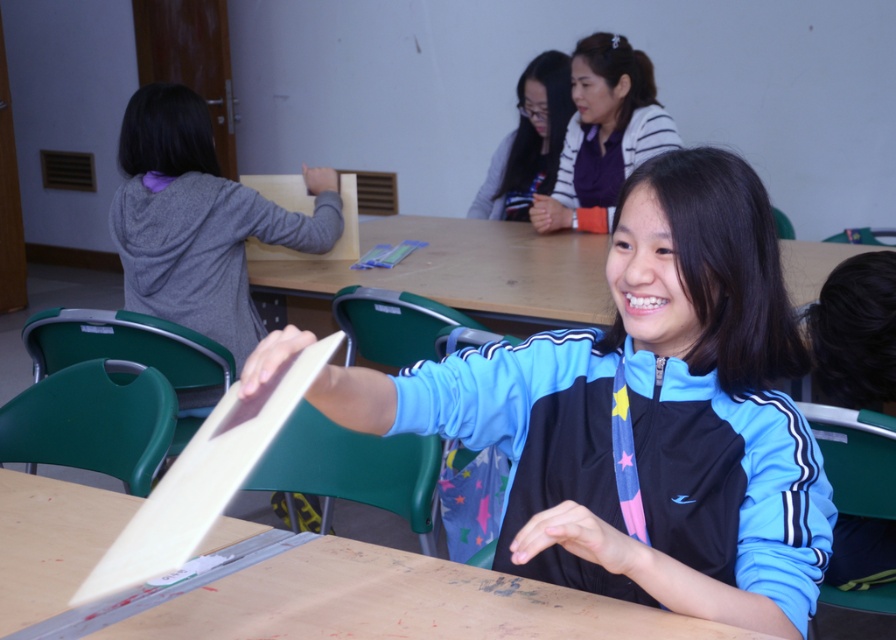
Question: Which point is farther to the camera?

Choices:
 (A) (113, 496)
 (B) (719, 282)

Answer: (A)

Question: Which point is farther from the camera taking this photo?

Choices:
 (A) (595, 202)
 (B) (221, 582)
 (C) (541, 192)
 (D) (545, 340)

Answer: (C)

Question: Does blue track jacket at center appear on the right side of matte black jacket at upper center?

Choices:
 (A) no
 (B) yes

Answer: (A)

Question: Is matte purple sweater at upper center positioned before matte black jacket at upper center?

Choices:
 (A) no
 (B) yes

Answer: (B)

Question: Which of the following is the closest to the observer?

Choices:
 (A) (543, 196)
 (B) (515, 177)
 (C) (565, 333)

Answer: (C)

Question: From the image, what is the correct spatial relationship of wooden table at center in relation to matte black jacket at upper center?

Choices:
 (A) left
 (B) right

Answer: (A)